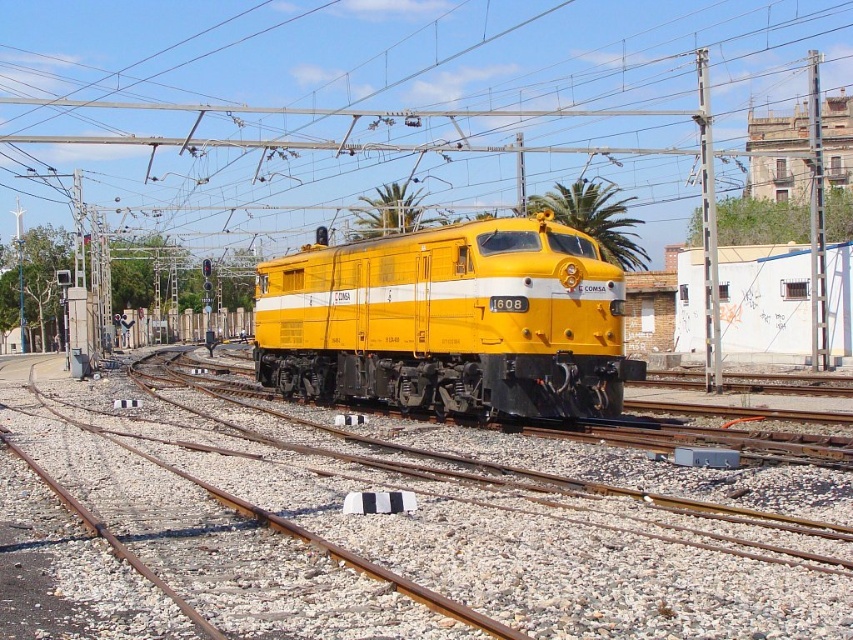
You are a train engineer who needs to align the yellow metal track at center with the yellow matte locomotive at center for maintenance. Based on the scene, which direction should you move the locomotive to align them properly?

The yellow metal track at center is to the left of the yellow matte locomotive at center, so you should move the yellow matte locomotive at center to the right to align it with the yellow metal track at center.

You are standing at the point marked by the coordinates (389, 524) in the image. What object are you directly positioned on?

You are directly positioned on the yellow metal track at center.

Looking at this image, you are a railway inspector checking the safety of the tracks. You notice the yellow metal track at center and the metallic wire at center. According to safety regulations, the minimum safe distance between such tracks and wires must be at least 250 feet. Is the current distance compliant with the regulations?

The distance between the yellow metal track at center and the metallic wire at center is 249.34 feet, which is less than the required 250 feet. Therefore, the current setup does not comply with safety regulations.